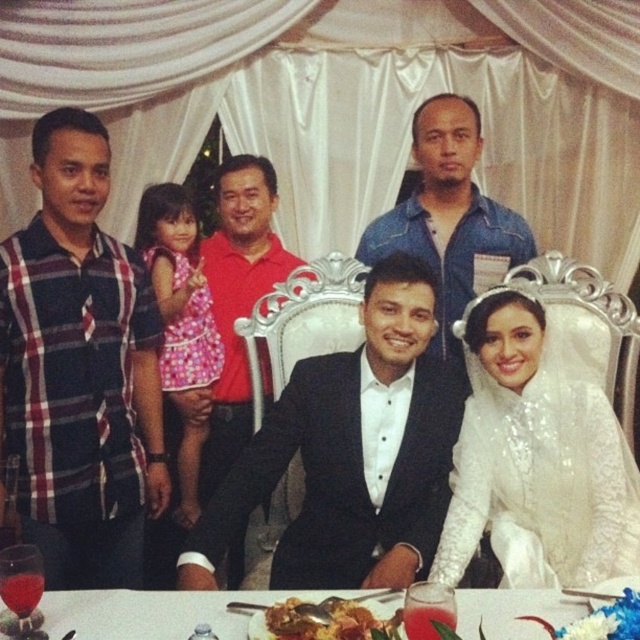
You are standing in front of the table at the event. You want to pick up an item located at point (384, 310) and another item at point (442, 531). Which item will you reach first if you move towards them in order?

You will reach the item at point (384, 310) first because it is closer to you than the item at point (442, 531).

You are a photographer standing at the event. You want to take a photo of the plaid fabric shirt at left without moving any objects. Can you capture it in your current position?

The plaid fabric shirt at left is 1.78 meters away from the viewer, so yes, you can capture it in your current position as the distance is within a typical camera lens range.